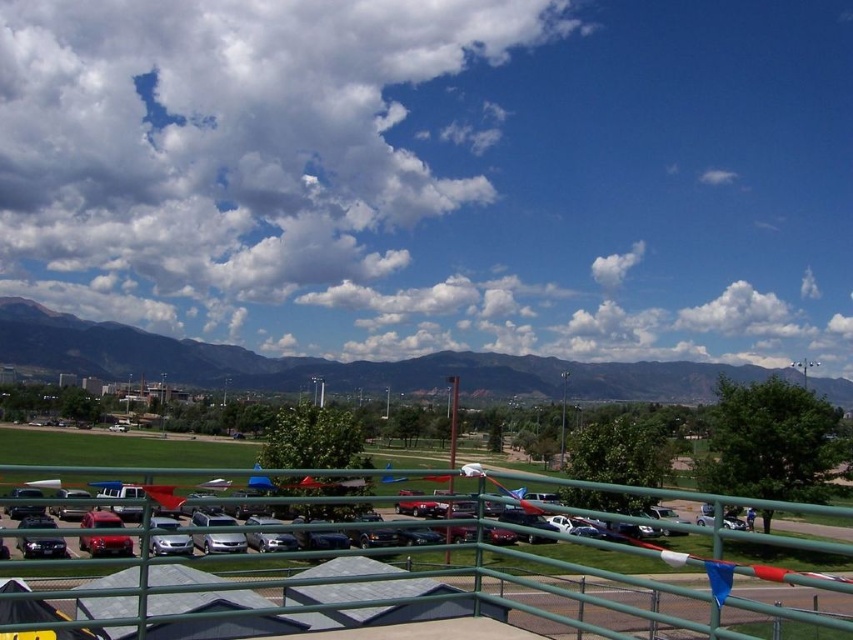
Question: Is white fluffy cloud at upper center to the left of satin silver sedan at center from the viewer's perspective?

Choices:
 (A) yes
 (B) no

Answer: (A)

Question: Among these objects, which one is nearest to the camera?

Choices:
 (A) green metal railing at center
 (B) satin silver sedan at center

Answer: (A)

Question: Observing the image, what is the correct spatial positioning of green grassy field at lower left in reference to satin silver sedan at center?

Choices:
 (A) below
 (B) above

Answer: (B)

Question: Which object appears farthest from the camera in this image?

Choices:
 (A) white fluffy cloud at upper center
 (B) satin silver sedan at center

Answer: (A)

Question: Is green metal railing at center above satin silver sedan at center?

Choices:
 (A) no
 (B) yes

Answer: (B)

Question: Estimate the real-world distances between objects in this image. Which object is closer to the white fluffy cloud at upper center?

Choices:
 (A) green grassy field at lower left
 (B) green metal railing at center
 (C) satin silver sedan at center

Answer: (A)